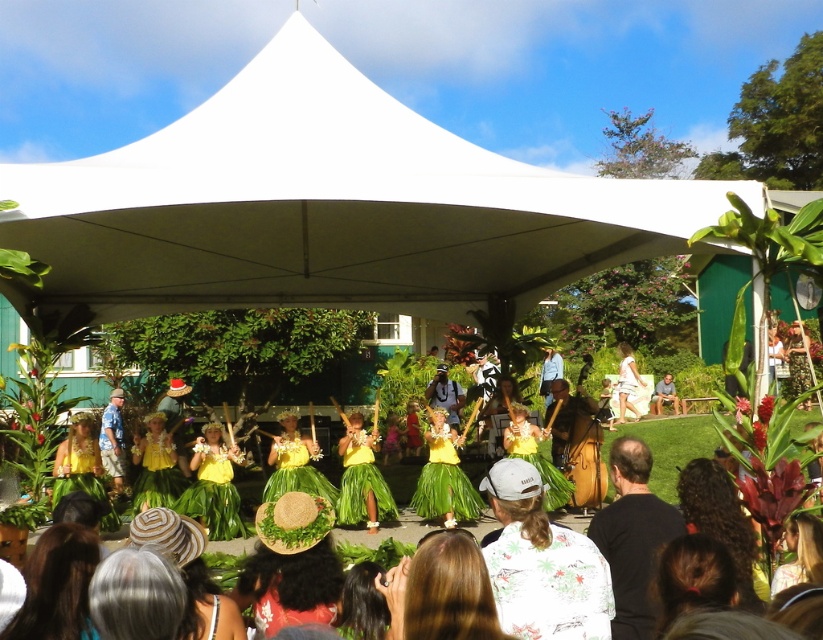
Is white fabric canopy at center to the right of light blue denim shirt at center from the viewer's perspective?

Correct, you'll find white fabric canopy at center to the right of light blue denim shirt at center.

Which of these two, white fabric canopy at center or light blue denim shirt at center, stands shorter?

light blue denim shirt at center is shorter.

Which is in front, point (291, 152) or point (105, 458)?

Point (291, 152) is in front.

The height and width of the screenshot is (640, 823). Identify the location of white fabric canopy at center. (328, 208).

Is white fabric canopy at center thinner than light brown wooden bench at center?

In fact, white fabric canopy at center might be wider than light brown wooden bench at center.

What do you see at coordinates (328, 208) in the screenshot? This screenshot has width=823, height=640. I see `white fabric canopy at center` at bounding box center [328, 208].

Who is more forward, (171, 298) or (658, 384)?

Point (171, 298)

Find the location of a particular element. white fabric canopy at center is located at coordinates (328, 208).

Is light blue denim shirt at center positioned at the back of light brown wooden bench at center?

No, light blue denim shirt at center is closer to the viewer.

Can you confirm if light blue denim shirt at center is wider than light brown wooden bench at center?

No, light blue denim shirt at center is not wider than light brown wooden bench at center.

Is point (122, 400) less distant than point (673, 408)?

Yes.

This screenshot has height=640, width=823. Identify the location of light blue denim shirt at center. (114, 440).